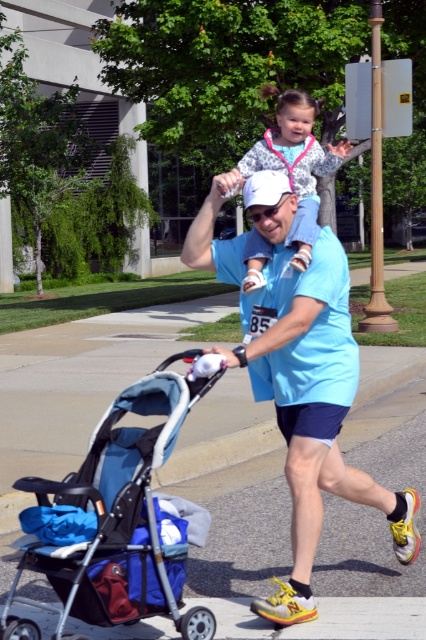
Question: Where is blue fabric stroller at lower left located in relation to speckled fleece jacket at upper center in the image?

Choices:
 (A) right
 (B) left

Answer: (B)

Question: Among these points, which one is farthest from the camera?

Choices:
 (A) (282, 109)
 (B) (201, 392)
 (C) (275, 600)

Answer: (A)

Question: Is light blue t-shirt at center positioned before blue fabric stroller at lower left?

Choices:
 (A) yes
 (B) no

Answer: (B)

Question: Estimate the real-world distances between objects in this image. Which object is farther from the light blue t-shirt at center?

Choices:
 (A) blue fabric stroller at lower left
 (B) speckled fleece jacket at upper center

Answer: (B)

Question: Can you confirm if blue fabric stroller at lower left is positioned to the right of speckled fleece jacket at upper center?

Choices:
 (A) yes
 (B) no

Answer: (B)

Question: Based on their relative distances, which object is farther from the blue fabric stroller at lower left?

Choices:
 (A) speckled fleece jacket at upper center
 (B) light blue t-shirt at center

Answer: (A)